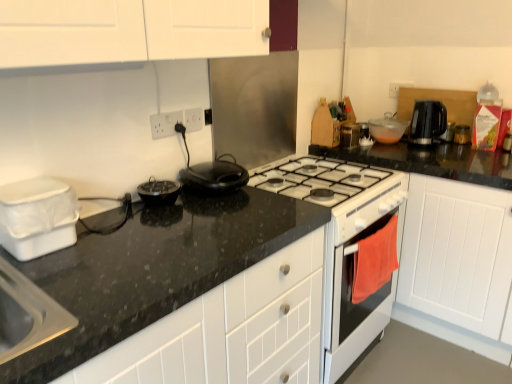
Where is `free space between black matte waffle maker at center, which is counted as the 5th kitchen appliance, starting from the right, and black matte waffle maker at center, acting as the 2th kitchen appliance starting from the front`? The image size is (512, 384). free space between black matte waffle maker at center, which is counted as the 5th kitchen appliance, starting from the right, and black matte waffle maker at center, acting as the 2th kitchen appliance starting from the front is located at coordinates (194, 204).